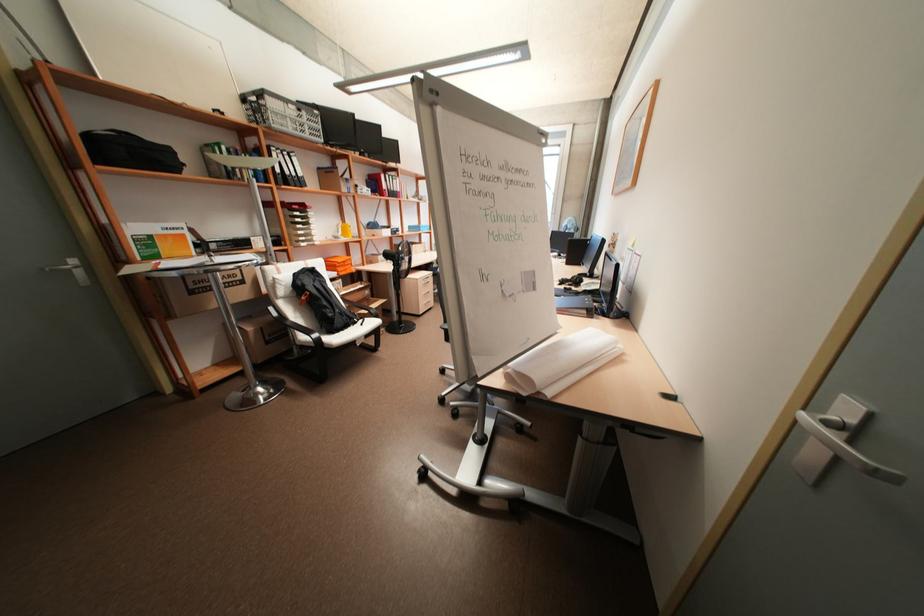
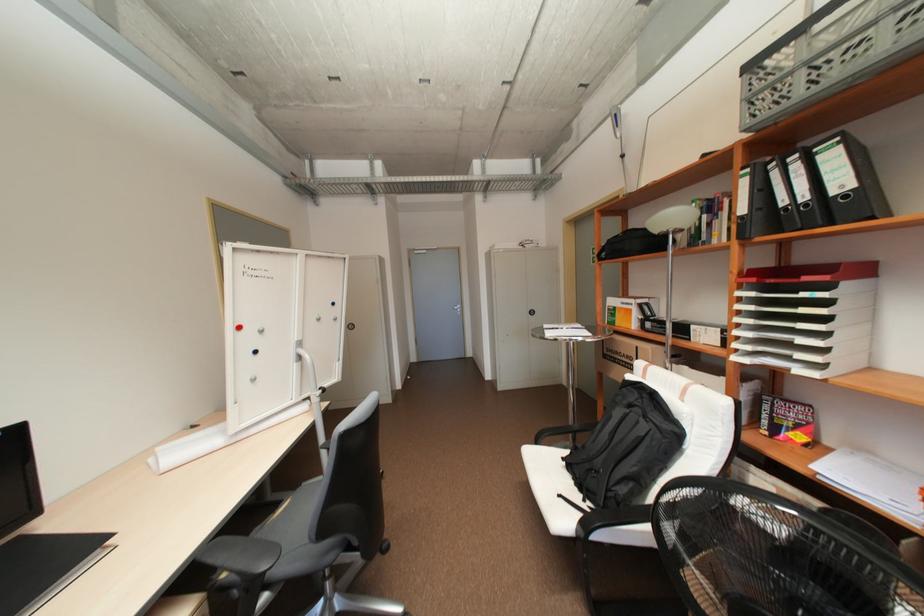
Locate, in the second image, the point that corresponds to point 299,172 in the first image.

(810, 197)